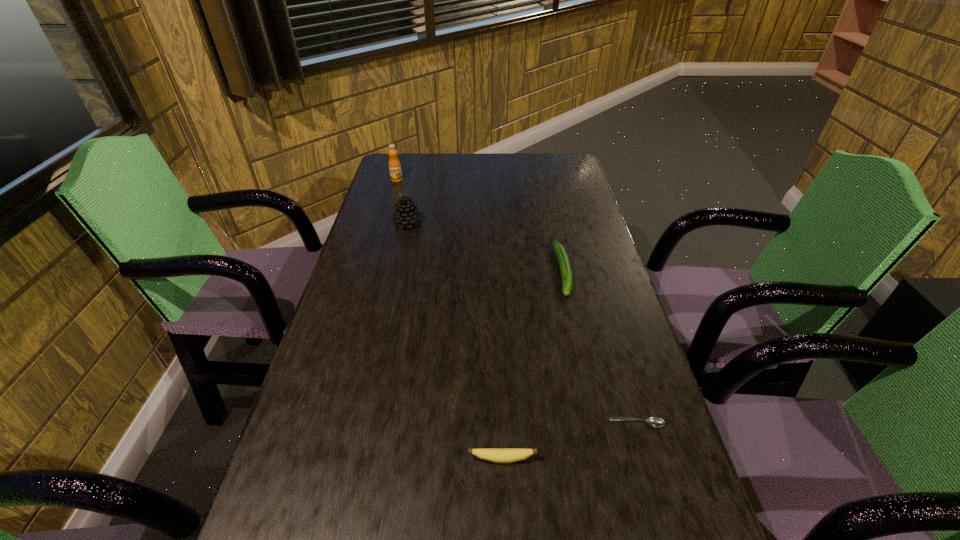
Image resolution: width=960 pixels, height=540 pixels. What are the coordinates of `empty location between the second object from left to right and the third object from right to left` in the screenshot? It's located at (455, 341).

Find the location of a particular element. vacant area between the second farthest object and the zucchini is located at coordinates (486, 247).

You are a GUI agent. You are given a task and a screenshot of the screen. Output one action in this format:
    pyautogui.click(x=<x>, y=<y>)
    Task: Click on the unoccupied area between the orange juice and the soupspoon
    The height and width of the screenshot is (540, 960).
    Given the screenshot: What is the action you would take?
    pyautogui.click(x=516, y=301)

Find the location of a particular element. The image size is (960, 540). free spot between the third object from right to left and the tallest object is located at coordinates (449, 320).

Select which object is the third closest to the third object from right to left. Please provide its 2D coordinates. Your answer should be formatted as a tuple, i.e. [(x, y)], where the tuple contains the x and y coordinates of a point satisfying the conditions above.

[(406, 214)]

Locate an element on the screen. The height and width of the screenshot is (540, 960). object that is the closest one to the third farthest object is located at coordinates (656, 422).

The width and height of the screenshot is (960, 540). Identify the location of free location that satisfies the following two spatial constraints: 1. on the front-facing side of the zucchini; 2. on the left side of the rightmost object. (597, 423).

Image resolution: width=960 pixels, height=540 pixels. Find the location of `blank area in the image that satisfies the following two spatial constraints: 1. on the front-facing side of the shortest object; 2. on the left side of the fourth object from left to right`. blank area in the image that satisfies the following two spatial constraints: 1. on the front-facing side of the shortest object; 2. on the left side of the fourth object from left to right is located at coordinates (597, 423).

Image resolution: width=960 pixels, height=540 pixels. Find the location of `free space that satisfies the following two spatial constraints: 1. on the front-facing side of the fourth farthest object; 2. on the right side of the third nearest object`. free space that satisfies the following two spatial constraints: 1. on the front-facing side of the fourth farthest object; 2. on the right side of the third nearest object is located at coordinates (597, 423).

Image resolution: width=960 pixels, height=540 pixels. In order to click on vacant space that satisfies the following two spatial constraints: 1. at the narrow end of the pinecone; 2. on the left side of the nearest object in this screenshot , I will do `click(356, 459)`.